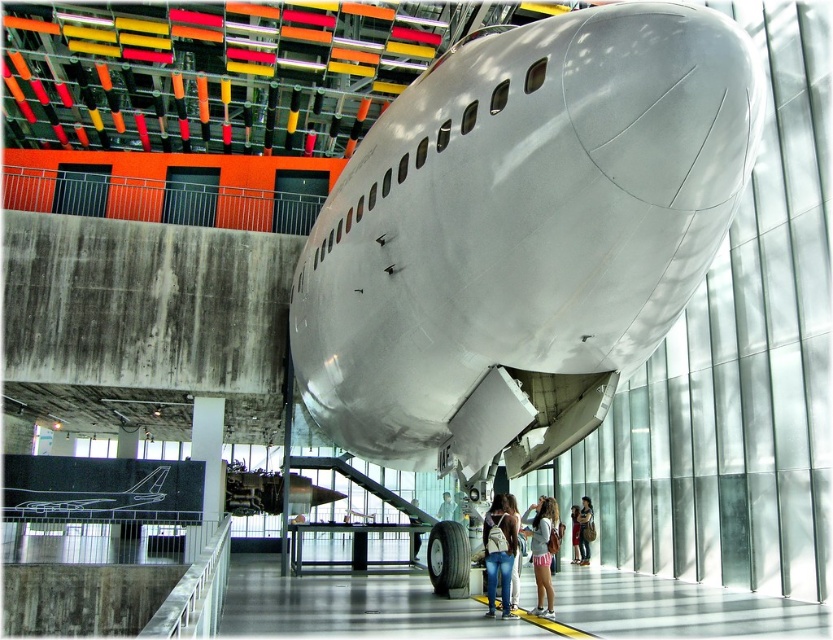
Question: Based on their relative distances, which object is farther from the denim jacket at lower right?

Choices:
 (A) light blue jeans at center
 (B) pink fabric shorts at lower center
 (C) polished aluminum airplane at center
 (D) denim jeans at center

Answer: (C)

Question: Is polished aluminum airplane at center closer to camera compared to light blue jeans at center?

Choices:
 (A) yes
 (B) no

Answer: (A)

Question: In this image, where is polished aluminum airplane at center located relative to pink fabric shorts at lower center?

Choices:
 (A) left
 (B) right

Answer: (A)

Question: Is polished aluminum airplane at center positioned before light blue jeans at center?

Choices:
 (A) no
 (B) yes

Answer: (B)

Question: Which point is closer to the camera?

Choices:
 (A) polished aluminum airplane at center
 (B) light blue jeans at center

Answer: (A)

Question: Considering the real-world distances, which object is farthest from the light blue jeans at center?

Choices:
 (A) pink fabric shorts at lower center
 (B) denim shorts at center
 (C) denim jacket at lower right

Answer: (A)